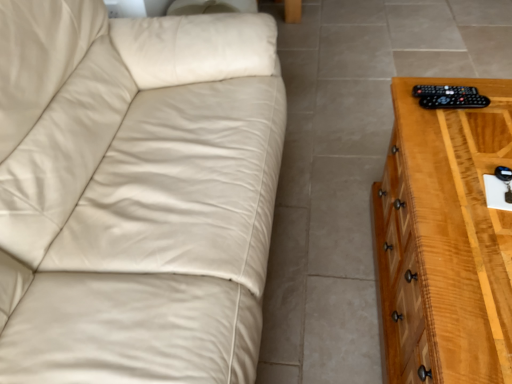
You are a GUI agent. You are given a task and a screenshot of the screen. Output one action in this format:
    pyautogui.click(x=<x>, y=<y>)
    Task: Click on the vacant space to the left of black plastic remote at right
    This screenshot has width=512, height=384.
    Given the screenshot: What is the action you would take?
    pyautogui.click(x=406, y=107)